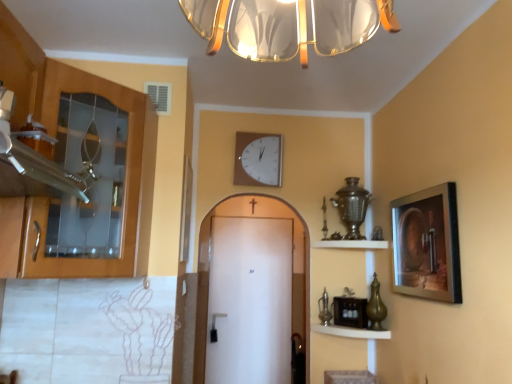
Question: Is metallic gold shelf at upper center, which is the first shelf from top to bottom, taller or shorter than wooden cabinet at left?

Choices:
 (A) tall
 (B) short

Answer: (B)

Question: From a real-world perspective, relative to wooden cabinet at left, is metallic gold shelf at upper center, which is the first shelf from top to bottom, vertically above or below?

Choices:
 (A) below
 (B) above

Answer: (A)

Question: Which object is positioned closest to the metallic gold shelf at upper center, which is the first shelf from top to bottom?

Choices:
 (A) white matte door at center
 (B) wooden shelf at lower center, the 1th shelf from the bottom
 (C) white plastic wall clock at upper center
 (D) wooden cabinet at left
 (E) metallic silver picture frame at right

Answer: (B)

Question: Considering the real-world distances, which object is closest to the wooden cabinet at left?

Choices:
 (A) wooden shelf at lower center, the 1th shelf from the bottom
 (B) white plastic wall clock at upper center
 (C) metallic silver picture frame at right
 (D) metallic gold shelf at upper center, which is the first shelf from top to bottom
 (E) white matte door at center

Answer: (B)